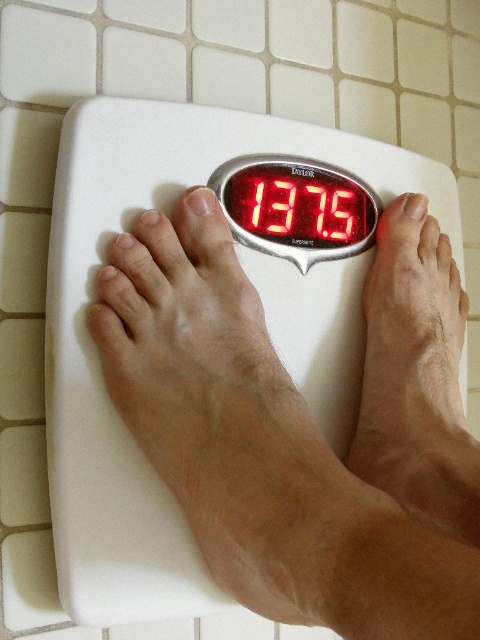
You are an architect designing a bathroom layout. You need to place a new digital scale in the bathroom such that the digital display screen is visible from the door. The bathroom door is positioned so that when you enter, you face the scale. Given the coordinates of two points on the scale, point1 at point(x=186, y=108) and point2 at point(x=324, y=186), which point is closer to the viewer when standing at the door to ensure the display is visible?

Point1 at point(x=186, y=108) is closer to the viewer than point2 at point(x=324, y=186), so placing the digital display screen near point1 would ensure it is visible from the door.

You are a physical therapist advising a patient on how to properly use the bathroom scale. The patient wants to ensure they are standing correctly. Based on the image, which object should the patient focus their eyes on while stepping onto the white plastic scale at center and the red digital display at center?

The patient should focus their eyes on the red digital display at center because the white plastic scale at center is located below it, so looking at the display will help them align their posture correctly over the scale.